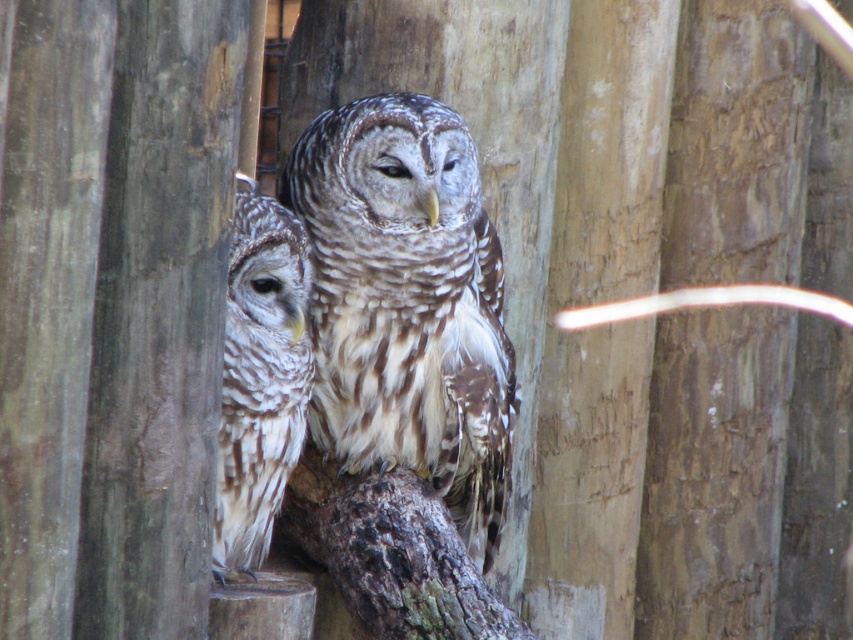
Is point (450, 400) farther from camera compared to point (260, 394)?

Yes, point (450, 400) is behind point (260, 394).

The height and width of the screenshot is (640, 853). I want to click on speckled feathered owl at center, so click(407, 305).

Is point (331, 424) behind point (221, 444)?

That is True.

Locate an element on the screen. The height and width of the screenshot is (640, 853). speckled feathered owl at center is located at coordinates (407, 305).